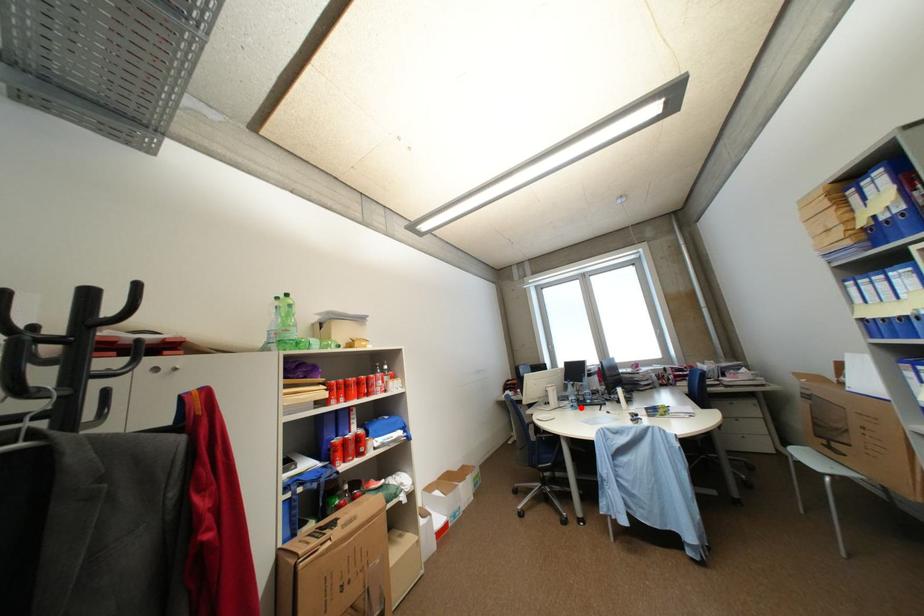
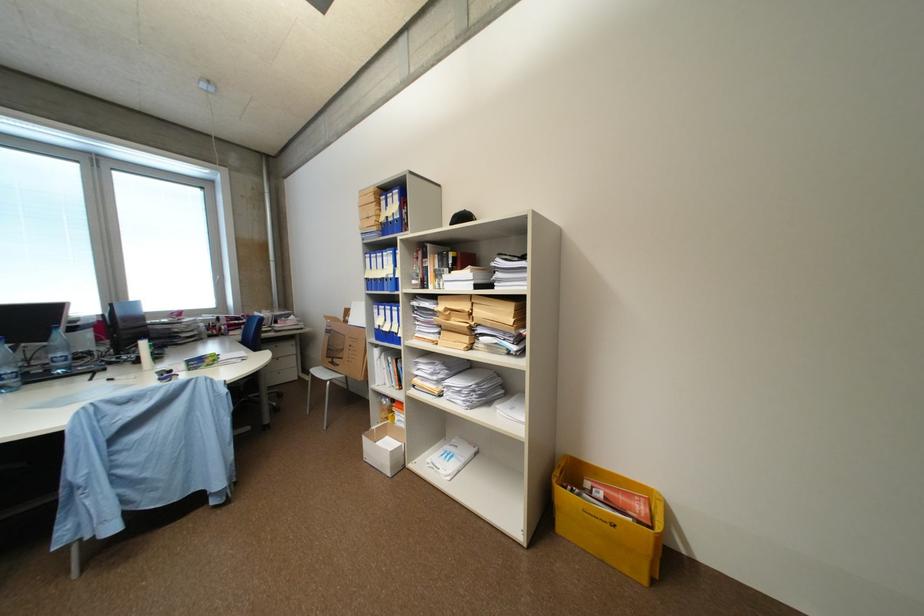
Where in the second image is the point corresponding to the highlighted location from the first image?

(10, 389)